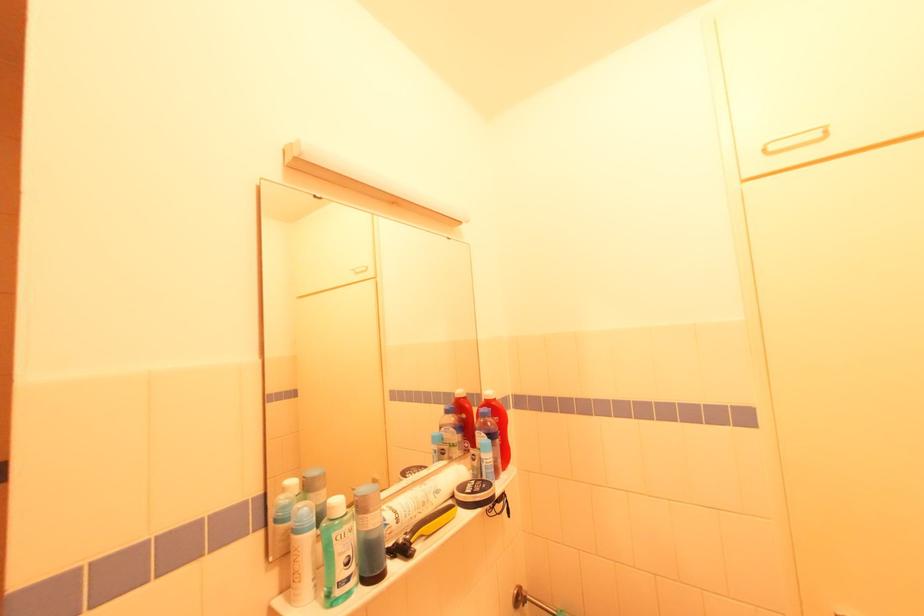
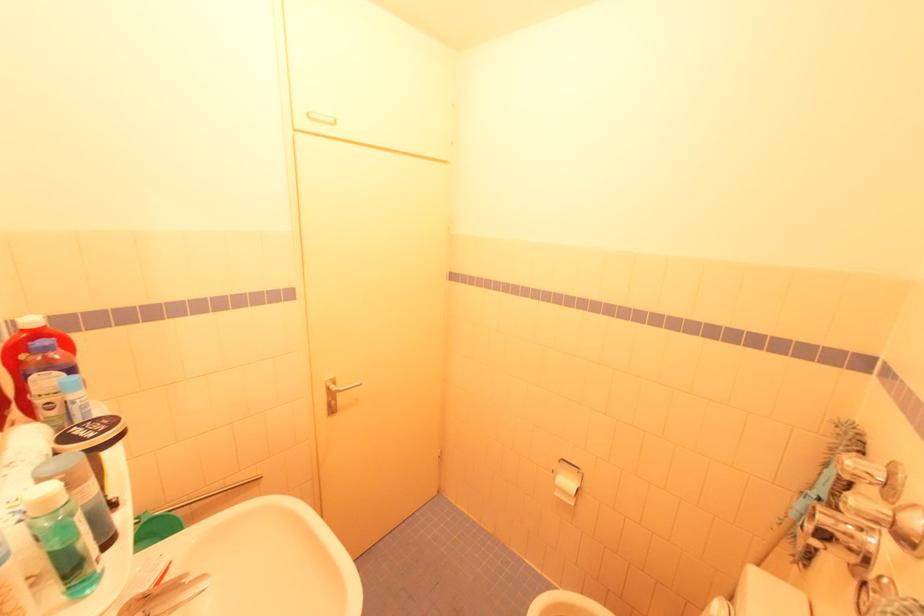
Question: How did the camera likely rotate?

Choices:
 (A) Left
 (B) Right
 (C) Up
 (D) Down

Answer: (B)